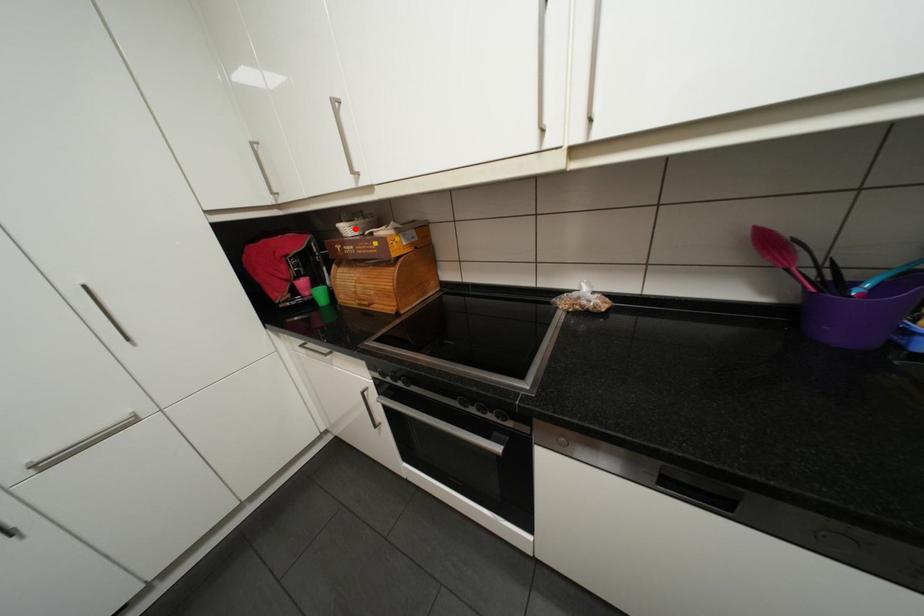
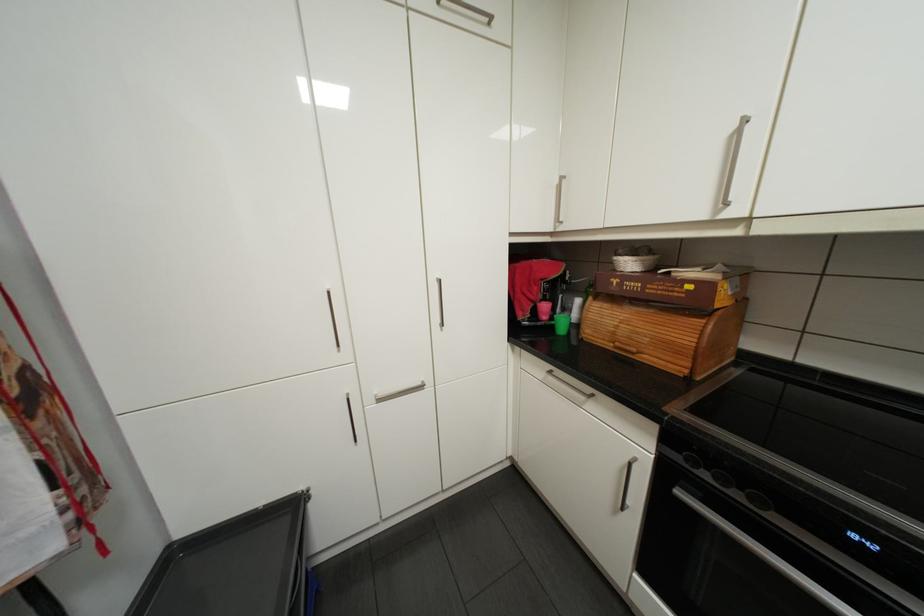
Find the pixel in the second image that matches the highlighted location in the first image.

(637, 262)